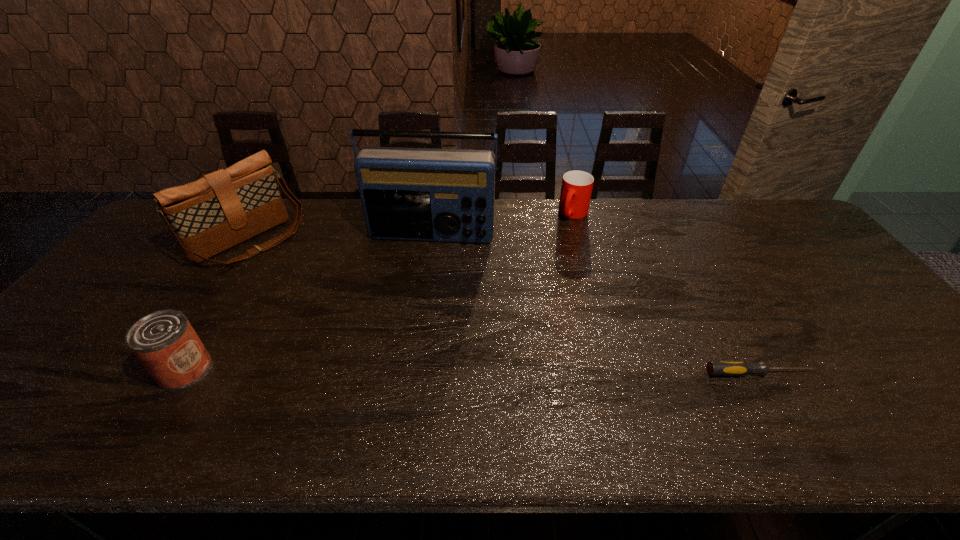
Find the location of `blank space located 0.130m on the front panel of the tallest object`. blank space located 0.130m on the front panel of the tallest object is located at coordinates (419, 277).

You are a GUI agent. You are given a task and a screenshot of the screen. Output one action in this format:
    pyautogui.click(x=<x>, y=<y>)
    Task: Click on the vacant point located on the front panel of the tallest object
    
    Given the screenshot: What is the action you would take?
    pyautogui.click(x=416, y=286)

Locate an element on the screen. The width and height of the screenshot is (960, 540). free spot located 0.310m on the side of the cup with the handle is located at coordinates (530, 278).

The height and width of the screenshot is (540, 960). Find the location of `vacant space located on the side of the cup with the handle`. vacant space located on the side of the cup with the handle is located at coordinates (523, 286).

Where is `blank area located on the side of the cup with the handle`? This screenshot has height=540, width=960. blank area located on the side of the cup with the handle is located at coordinates (553, 246).

I want to click on free space located on the front-facing side of the second tallest object, so click(291, 274).

You are a GUI agent. You are given a task and a screenshot of the screen. Output one action in this format:
    pyautogui.click(x=<x>, y=<y>)
    Task: Click on the free spot located 0.170m on the front-facing side of the second tallest object
    Image resolution: width=960 pixels, height=540 pixels.
    Given the screenshot: What is the action you would take?
    pyautogui.click(x=308, y=288)

Where is `blank area located on the front-facing side of the second tallest object`? Image resolution: width=960 pixels, height=540 pixels. blank area located on the front-facing side of the second tallest object is located at coordinates (357, 328).

Locate an element on the screen. The width and height of the screenshot is (960, 540). radio receiver located in the far edge section of the desktop is located at coordinates (444, 195).

Locate an element on the screen. cup that is at the far edge is located at coordinates (576, 189).